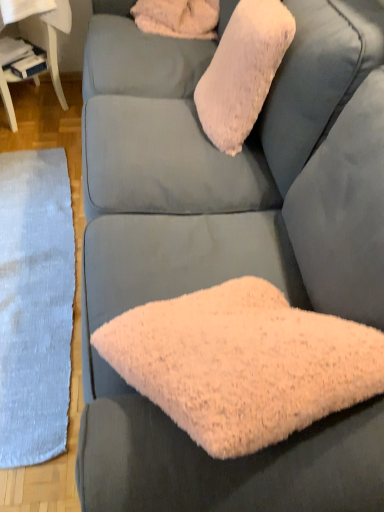
Question: Does fluffy pink pillow at upper center have a smaller size compared to white fluffy pillow at upper center?

Choices:
 (A) yes
 (B) no

Answer: (B)

Question: Can we say fluffy pink pillow at upper center lies outside white fluffy pillow at upper center?

Choices:
 (A) yes
 (B) no

Answer: (A)

Question: Is fluffy pink pillow at upper center shorter than white fluffy pillow at upper center?

Choices:
 (A) no
 (B) yes

Answer: (A)

Question: From a real-world perspective, is fluffy pink pillow at upper center located higher than white fluffy pillow at upper center?

Choices:
 (A) yes
 (B) no

Answer: (A)

Question: From the image's perspective, would you say fluffy pink pillow at upper center is shown under white fluffy pillow at upper center?

Choices:
 (A) no
 (B) yes

Answer: (B)

Question: Considering the relative sizes of fluffy pink pillow at upper center and white fluffy pillow at upper center in the image provided, is fluffy pink pillow at upper center wider than white fluffy pillow at upper center?

Choices:
 (A) no
 (B) yes

Answer: (A)

Question: Is white fluffy pillow at upper center facing away from white glossy table at lower left?

Choices:
 (A) yes
 (B) no

Answer: (B)

Question: Considering the relative sizes of white fluffy pillow at upper center and white glossy table at lower left in the image provided, is white fluffy pillow at upper center shorter than white glossy table at lower left?

Choices:
 (A) no
 (B) yes

Answer: (B)

Question: Is white fluffy pillow at upper center not near white glossy table at lower left?

Choices:
 (A) yes
 (B) no

Answer: (B)

Question: Can you confirm if white fluffy pillow at upper center is smaller than white glossy table at lower left?

Choices:
 (A) yes
 (B) no

Answer: (A)

Question: Is white fluffy pillow at upper center oriented towards white glossy table at lower left?

Choices:
 (A) yes
 (B) no

Answer: (B)

Question: Does white fluffy pillow at upper center lie behind white glossy table at lower left?

Choices:
 (A) no
 (B) yes

Answer: (B)

Question: Can you confirm if fluffy pink pillow at upper center is wider than white glossy table at lower left?

Choices:
 (A) yes
 (B) no

Answer: (B)